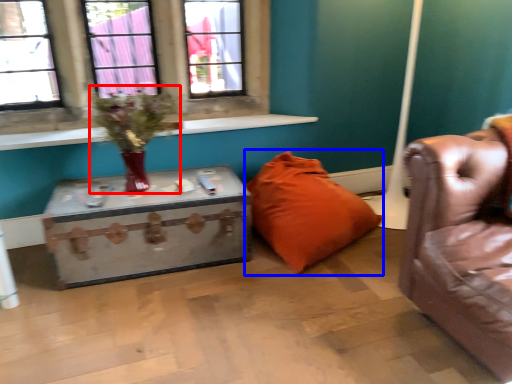
Question: Which object appears farthest to the camera in this image, floral arrangement (highlighted by a red box) or pillow (highlighted by a blue box)?

Choices:
 (A) floral arrangement
 (B) pillow

Answer: (B)